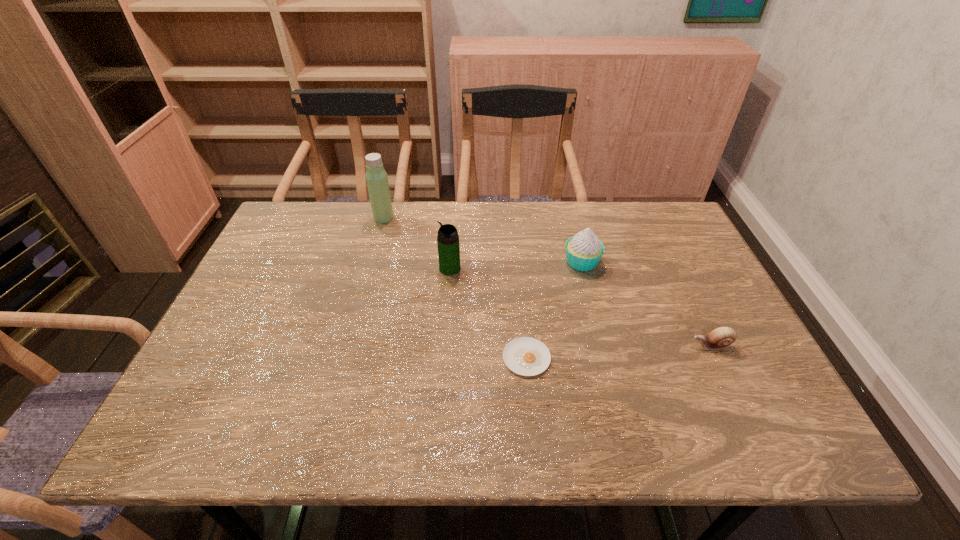
Where is `the tallest object`? The height and width of the screenshot is (540, 960). the tallest object is located at coordinates point(376,177).

The image size is (960, 540). In order to click on the taller thermos bottle in this screenshot , I will do `click(376, 177)`.

What are the coordinates of `the fourth object from right to left` in the screenshot? It's located at (447, 239).

At what (x,y) coordinates should I click in order to perform the action: click on the nearer thermos bottle. Please return your answer as a coordinate pair (x, y). Looking at the image, I should click on (447, 239).

This screenshot has height=540, width=960. Find the location of `the fourth object from left to right`. the fourth object from left to right is located at coordinates (584, 250).

This screenshot has width=960, height=540. Find the location of `cupcake`. cupcake is located at coordinates (584, 250).

You are a GUI agent. You are given a task and a screenshot of the screen. Output one action in this format:
    pyautogui.click(x=<x>, y=<y>)
    Task: Click on the escargot
    This screenshot has height=540, width=960.
    Given the screenshot: What is the action you would take?
    pyautogui.click(x=722, y=337)

The width and height of the screenshot is (960, 540). In order to click on the rightmost object in this screenshot , I will do `click(722, 337)`.

Image resolution: width=960 pixels, height=540 pixels. In order to click on egg yolk in this screenshot , I will do `click(526, 356)`.

This screenshot has width=960, height=540. What are the coordinates of `the shortest object` in the screenshot? It's located at [x=526, y=356].